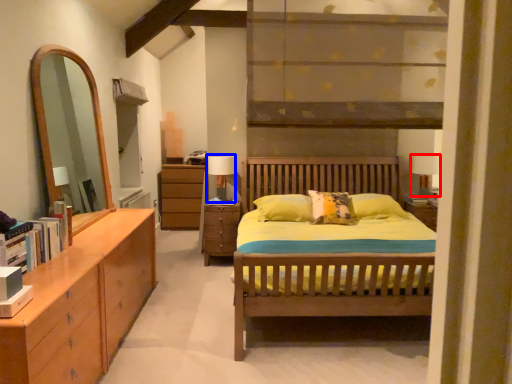
Question: Which point is further to the camera, table lamp (highlighted by a red box) or table lamp (highlighted by a blue box)?

Choices:
 (A) table lamp
 (B) table lamp

Answer: (A)